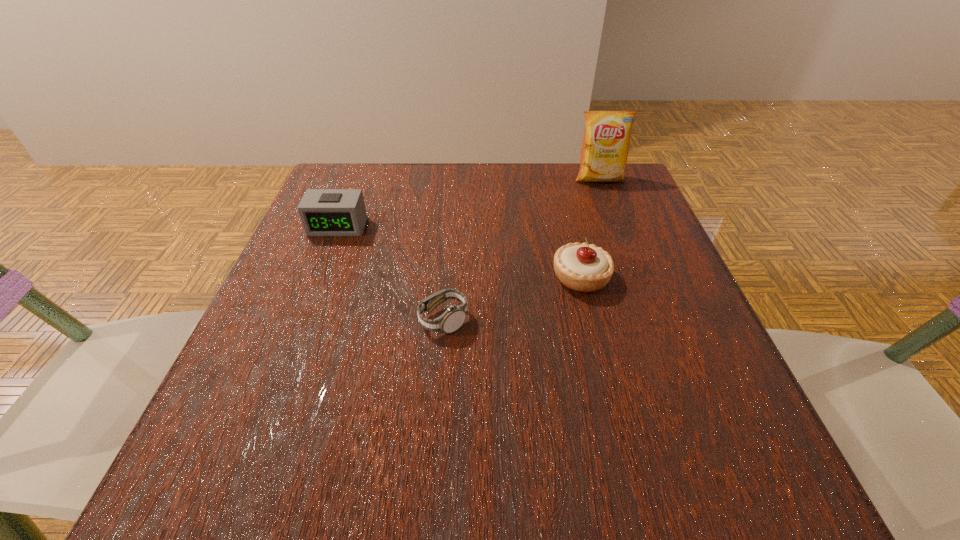
Find the location of a particular element. This screenshot has width=960, height=540. the tallest object is located at coordinates (605, 146).

You are a GUI agent. You are given a task and a screenshot of the screen. Output one action in this format:
    pyautogui.click(x=<x>, y=<y>)
    Task: Click on the crisp (potato chip)
    
    Given the screenshot: What is the action you would take?
    pyautogui.click(x=605, y=146)

The width and height of the screenshot is (960, 540). In order to click on pastry in this screenshot , I will do `click(580, 267)`.

The height and width of the screenshot is (540, 960). I want to click on alarm clock, so [x=324, y=212].

Where is `the leftmost object`? Image resolution: width=960 pixels, height=540 pixels. the leftmost object is located at coordinates (324, 212).

Locate an element on the screen. This screenshot has height=540, width=960. the shortest object is located at coordinates (452, 319).

Where is `the nearest object`? Image resolution: width=960 pixels, height=540 pixels. the nearest object is located at coordinates (452, 319).

The width and height of the screenshot is (960, 540). I want to click on vacant region located 0.150m on the front-facing side of the crisp (potato chip), so click(x=616, y=224).

At what (x,y) coordinates should I click in order to perform the action: click on vacant area situated 0.160m on the back of the second nearest object. Please return your answer as a coordinate pair (x, y). Looking at the image, I should click on (564, 212).

This screenshot has height=540, width=960. In order to click on vacant space located 0.160m on the front-facing side of the third nearest object in this screenshot , I will do `click(313, 290)`.